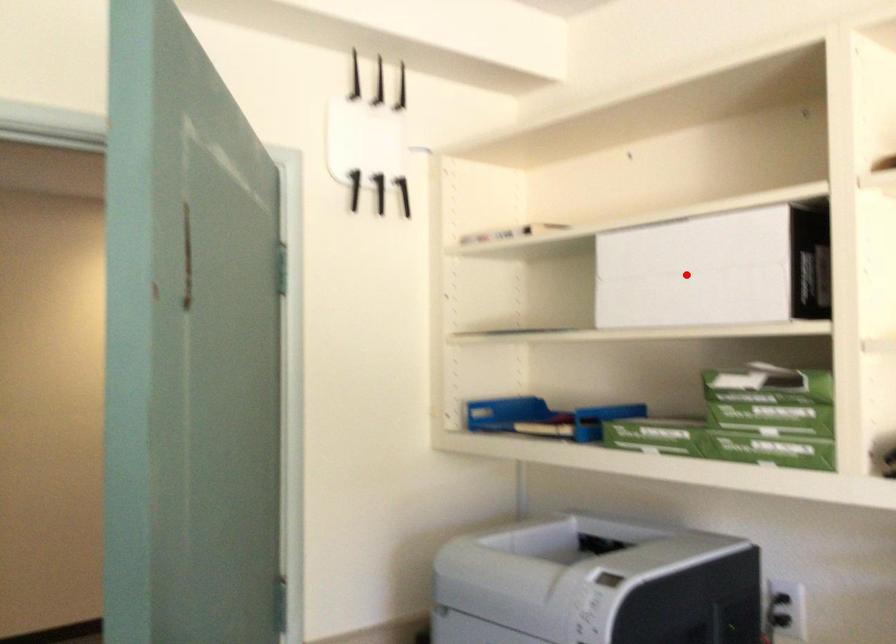
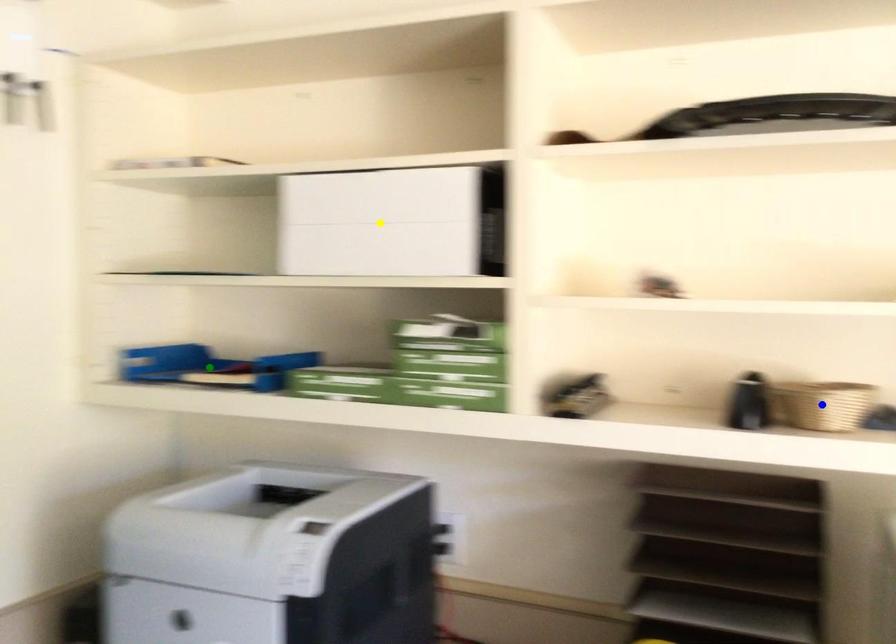
Question: I am providing you with two images of the same scene from different viewpoints. A red point is marked on the first image. You are given multiple points on the second image. Which mark in image 2 goes with the point in image 1?

Choices:
 (A) blue point
 (B) yellow point
 (C) green point

Answer: (B)